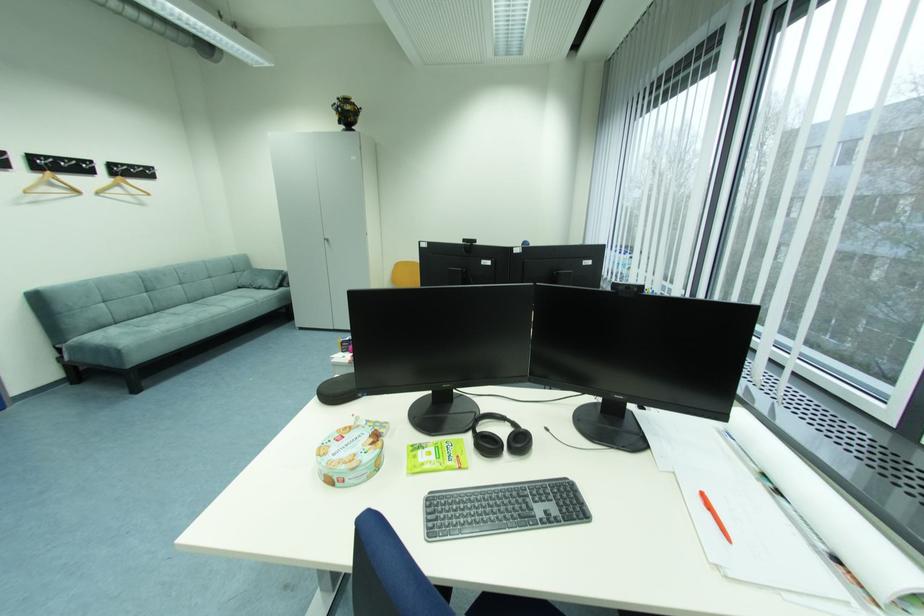
Find where to hang the black coat hook. Please return your answer as a coordinate pair (x, y).

(500, 437)